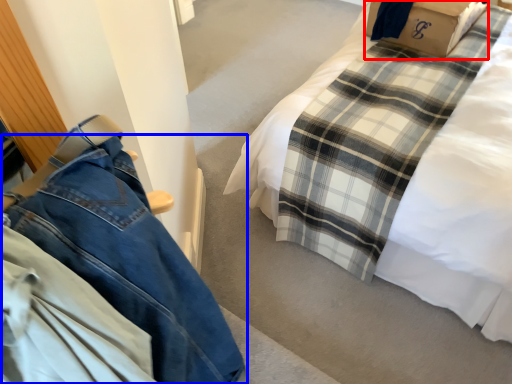
Question: Which object appears farthest to the camera in this image, cardboard box (highlighted by a red box) or trousers (highlighted by a blue box)?

Choices:
 (A) cardboard box
 (B) trousers

Answer: (A)